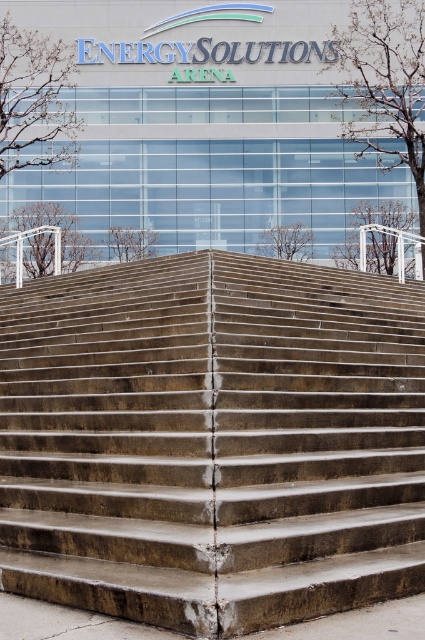
Between concrete stairs at center and concrete steps at lower center, which one has less height?

With less height is concrete stairs at center.

Between concrete stairs at center and concrete steps at lower center, which one appears on the right side from the viewer's perspective?

Positioned to the right is concrete stairs at center.

Image resolution: width=425 pixels, height=640 pixels. Describe the element at coordinates (212, 440) in the screenshot. I see `concrete stairs at center` at that location.

At what (x,y) coordinates should I click in order to perform the action: click on concrete stairs at center. Please return your answer as a coordinate pair (x, y). Looking at the image, I should click on (212, 440).